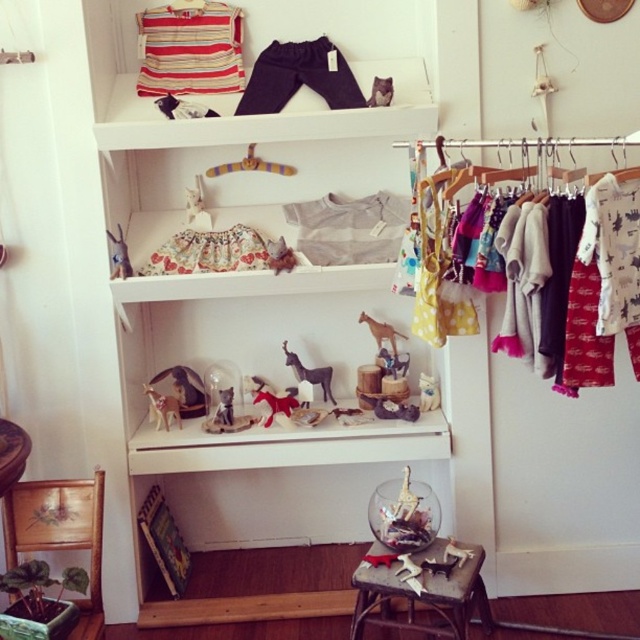
You are a customer looking to purchase a dress and pants for a child. You notice the yellow polka dot dress at upper right and the dark blue cotton pants at upper center. Which item is positioned lower on the shelving unit?

Answer: The yellow polka dot dress at upper right is positioned below the dark blue cotton pants at upper center, so it is lower on the shelving unit.

You are a customer in a store and see the velvet plush horse at center and the fluffy fabric dress at center on a shelf. Which item is closer to you?

The velvet plush horse at center is closer to you because it is in front of the fluffy fabric dress at center.

You are a store employee arranging dresses in the display. You need to place a new dress that is 30 cm wide. The yellow polka dot dress at upper right and the fluffy fabric dress at center are already there. Which existing dress should you compare the new dress to determine if it fits on the shelf?

The yellow polka dot dress at upper right is wider than the fluffy fabric dress at center. Since the new dress is 30 cm wide, you should compare it with the yellow polka dot dress at upper right to ensure there is enough space.